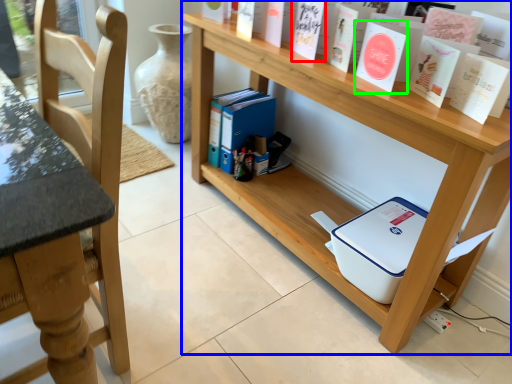
Question: Based on their relative distances, which object is nearer to paperback book (highlighted by a red box)? Choose from shelf (highlighted by a blue box) and paperback book (highlighted by a green box).

Choices:
 (A) shelf
 (B) paperback book

Answer: (B)